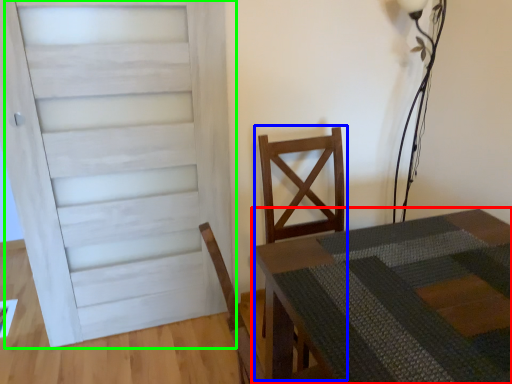
Question: Based on their relative distances, which object is nearer to table (highlighted by a red box)? Choose from armchair (highlighted by a blue box) and door (highlighted by a green box).

Choices:
 (A) armchair
 (B) door

Answer: (A)